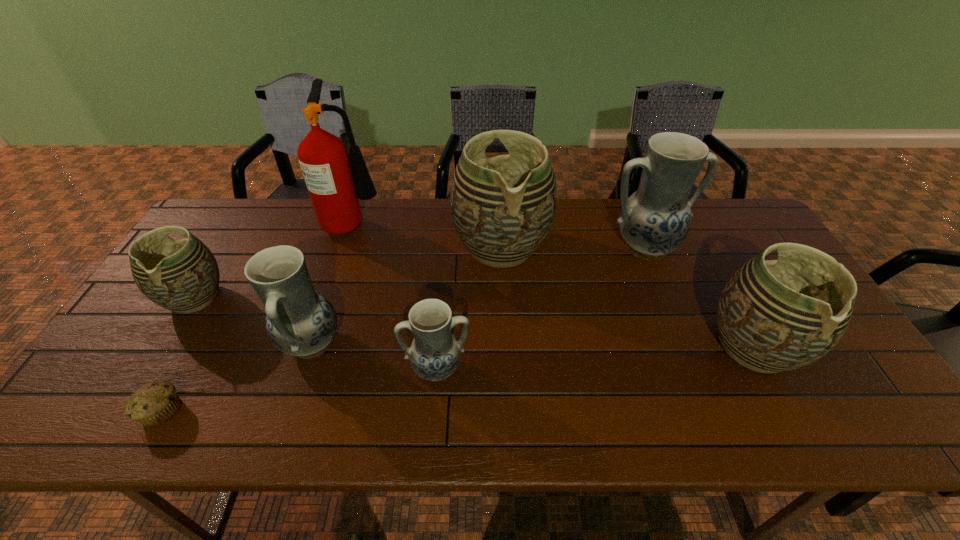
You are a GUI agent. You are given a task and a screenshot of the screen. Output one action in this format:
    pyautogui.click(x=<x>, y=<y>)
    Task: Click on the free space located on the left of the shortest object
    This screenshot has width=960, height=540.
    Given the screenshot: What is the action you would take?
    pyautogui.click(x=82, y=410)

Where is `fire extinguisher that is positioned at the far edge`? fire extinguisher that is positioned at the far edge is located at coordinates (323, 157).

Where is `object that is at the near edge`? This screenshot has width=960, height=540. object that is at the near edge is located at coordinates (155, 403).

In order to click on pottery present at the left edge in this screenshot , I will do `click(183, 276)`.

The height and width of the screenshot is (540, 960). What are the coordinates of `muffin at the left edge` in the screenshot? It's located at (155, 403).

At what (x,y) coordinates should I click in order to perform the action: click on object positioned at the right edge. Please return your answer as a coordinate pair (x, y). The width and height of the screenshot is (960, 540). Looking at the image, I should click on (773, 316).

I want to click on object present at the near left corner, so click(x=155, y=403).

In order to click on blank area at the far edge in this screenshot , I will do `click(266, 236)`.

Where is `vacant space at the near edge of the desktop`? The height and width of the screenshot is (540, 960). vacant space at the near edge of the desktop is located at coordinates (695, 410).

You are a GUI agent. You are given a task and a screenshot of the screen. Output one action in this format:
    pyautogui.click(x=<x>, y=<y>)
    Task: Click on the vacant position at the left edge of the desktop
    The width and height of the screenshot is (960, 540).
    Given the screenshot: What is the action you would take?
    pyautogui.click(x=113, y=367)